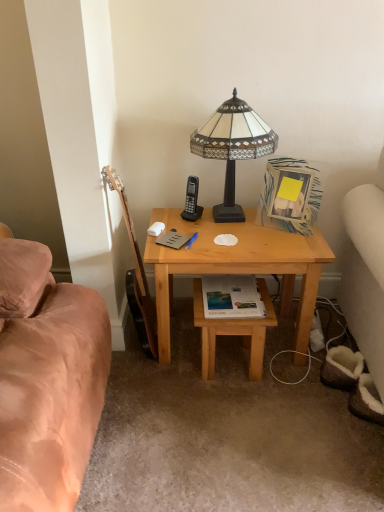
Where is `vacant position to the left of light brown wooden stool at lower center`? vacant position to the left of light brown wooden stool at lower center is located at coordinates click(x=174, y=369).